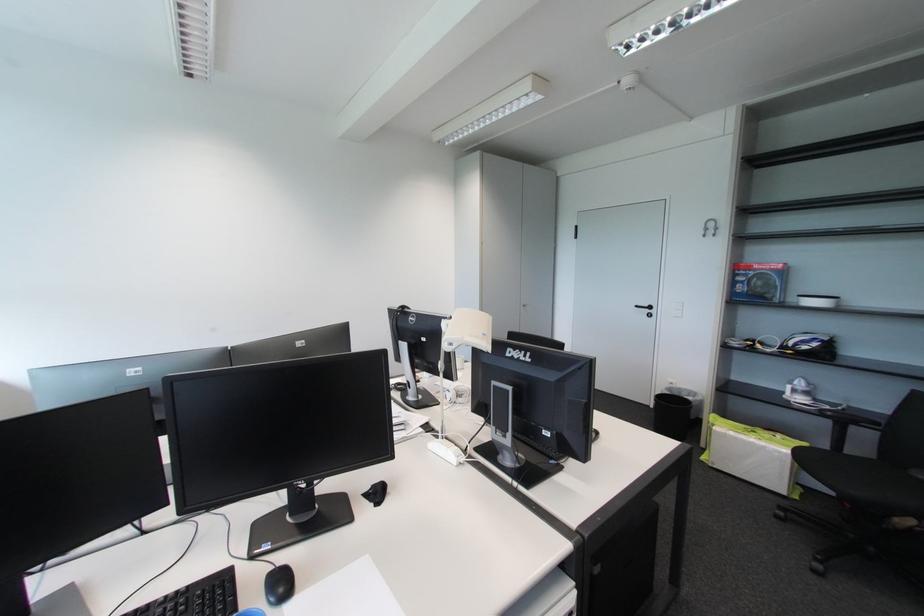
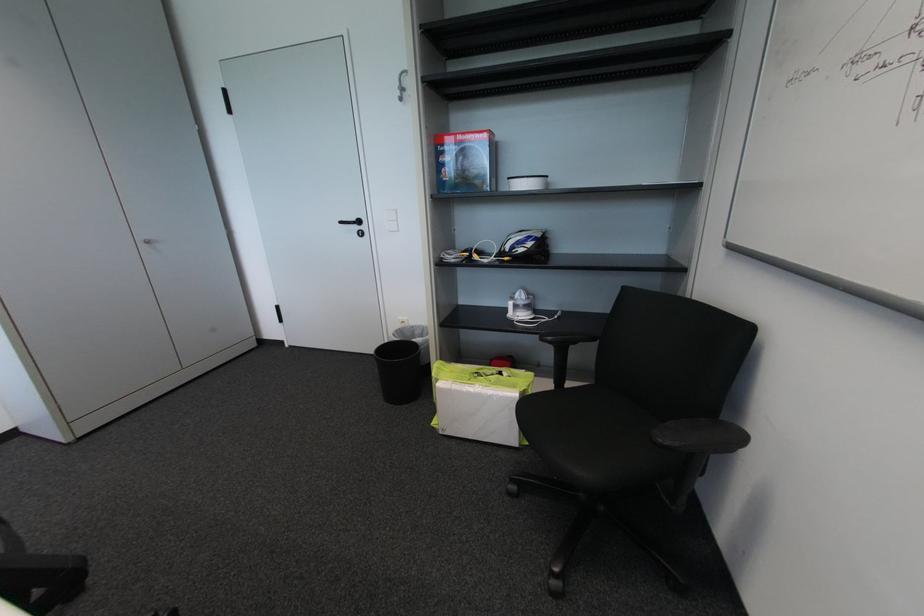
Where in the second image is the point corresponding to point (806, 297) from the first image?

(516, 180)